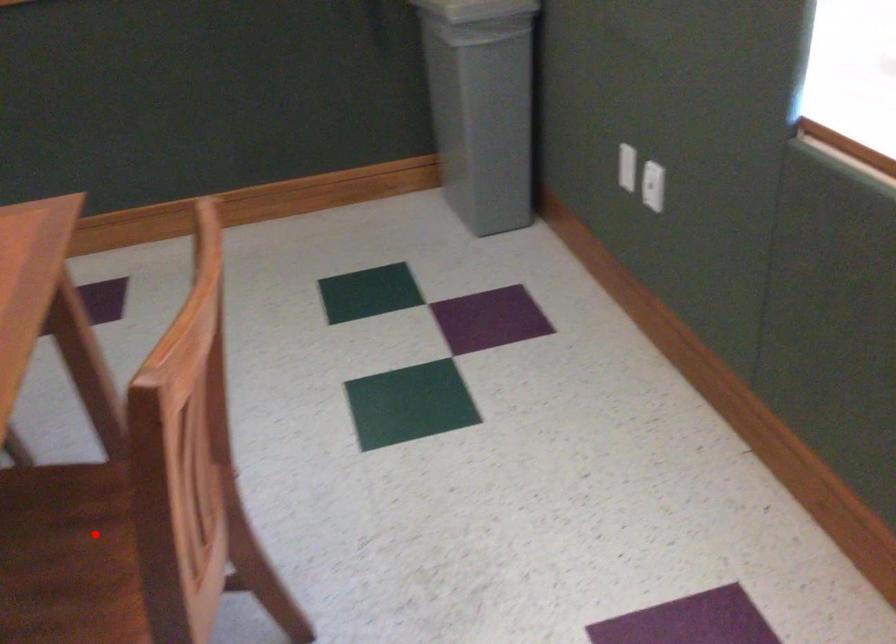
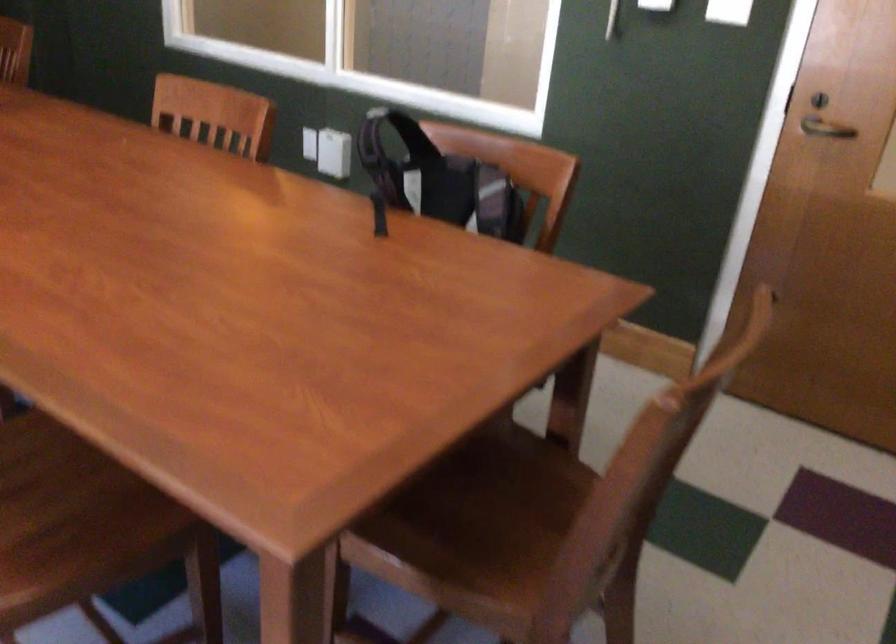
Question: I am providing you with two images of the same scene from different viewpoints. In image1, a red point is highlighted. Considering the same 3D point in image2, which of the following is correct?

Choices:
 (A) It is closer
 (B) It is farther

Answer: (B)